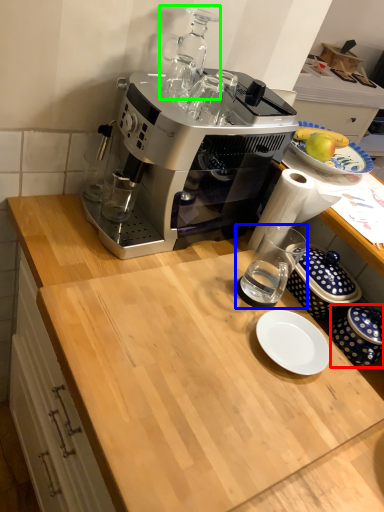
Question: Which object is the closest to the tableware (highlighted by a red box)? Choose among these: coffee cup (highlighted by a blue box) or appliance (highlighted by a green box).

Choices:
 (A) coffee cup
 (B) appliance

Answer: (A)